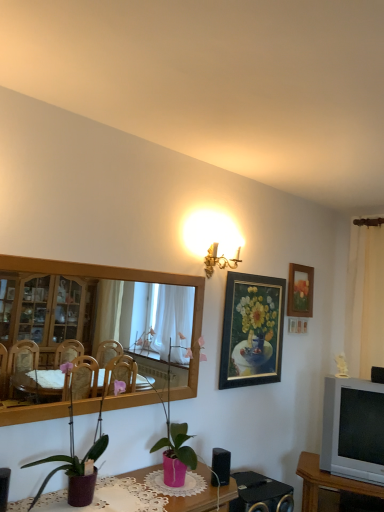
Question: Does white fabric curtain at right have a lesser width compared to black plastic speaker at lower center, positioned as the 1th speaker in left-to-right order?

Choices:
 (A) no
 (B) yes

Answer: (A)

Question: Can you confirm if white fabric curtain at right is positioned to the right of black plastic speaker at lower center, which ranks as the 2th speaker in top-to-bottom order?

Choices:
 (A) no
 (B) yes

Answer: (B)

Question: From a real-world perspective, is white fabric curtain at right below black plastic speaker at lower center, arranged as the 1th speaker when viewed from the front?

Choices:
 (A) no
 (B) yes

Answer: (A)

Question: From a real-world perspective, does white fabric curtain at right stand above black plastic speaker at lower center, which is counted as the second speaker, starting from the back?

Choices:
 (A) yes
 (B) no

Answer: (A)

Question: Are white fabric curtain at right and black plastic speaker at lower center, which is counted as the second speaker, starting from the back, making contact?

Choices:
 (A) yes
 (B) no

Answer: (B)

Question: Is white fabric curtain at right outside black plastic speaker at lower center, which is counted as the second speaker, starting from the back?

Choices:
 (A) yes
 (B) no

Answer: (A)

Question: From a real-world perspective, is silver metallic television at right physically above gold metallic wall sconce at upper center?

Choices:
 (A) yes
 (B) no

Answer: (B)

Question: Is silver metallic television at right surrounding gold metallic wall sconce at upper center?

Choices:
 (A) no
 (B) yes

Answer: (A)

Question: From the image's perspective, is silver metallic television at right beneath gold metallic wall sconce at upper center?

Choices:
 (A) yes
 (B) no

Answer: (A)

Question: Does silver metallic television at right have a smaller size compared to gold metallic wall sconce at upper center?

Choices:
 (A) yes
 (B) no

Answer: (B)

Question: Is silver metallic television at right at the left side of gold metallic wall sconce at upper center?

Choices:
 (A) no
 (B) yes

Answer: (A)

Question: Is silver metallic television at right not close to gold metallic wall sconce at upper center?

Choices:
 (A) yes
 (B) no

Answer: (A)

Question: Is purple matte plant pot at lower left, which is the 1th houseplant from front to back, closer to the viewer compared to gold-framed painting at upper right, acting as the 1th picture frame starting from the front?

Choices:
 (A) no
 (B) yes

Answer: (B)